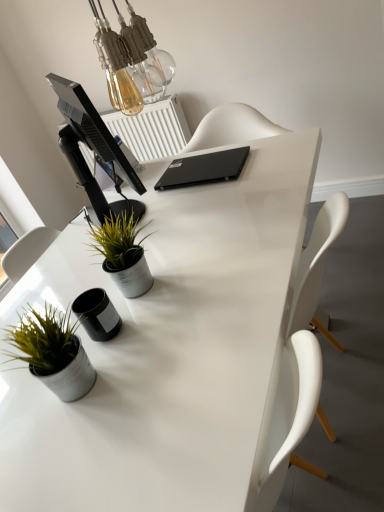
I want to click on vacant space behind metallic gray pot at center, placed as the 1th houseplant when sorted from top to bottom, so click(148, 239).